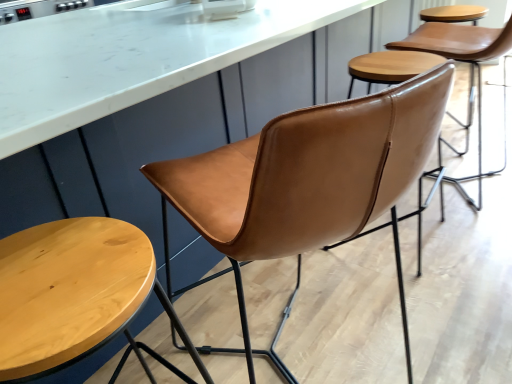
Question: Does cognac leather chair at center, acting as the 1th chair starting from the front, lie in front of wooden stool at lower left?

Choices:
 (A) no
 (B) yes

Answer: (B)

Question: From the image's perspective, would you say cognac leather chair at center, acting as the 1th chair starting from the front, is shown under wooden stool at lower left?

Choices:
 (A) yes
 (B) no

Answer: (B)

Question: Is cognac leather chair at center, acting as the 1th chair starting from the front, outside of wooden stool at lower left?

Choices:
 (A) no
 (B) yes

Answer: (B)

Question: From a real-world perspective, is cognac leather chair at center, arranged as the first chair when viewed from the left, located beneath wooden stool at lower left?

Choices:
 (A) no
 (B) yes

Answer: (A)

Question: Is cognac leather chair at center, which is counted as the second chair, starting from the right, looking in the opposite direction of wooden stool at lower left?

Choices:
 (A) yes
 (B) no

Answer: (B)

Question: Is cognac leather chair at center, arranged as the first chair when viewed from the left, to the left or to the right of wooden stool at lower left in the image?

Choices:
 (A) left
 (B) right

Answer: (B)

Question: In the image, is cognac leather chair at center, arranged as the first chair when viewed from the left, positioned in front of or behind wooden stool at lower left?

Choices:
 (A) behind
 (B) front

Answer: (B)

Question: Does point (297, 140) appear closer or farther from the camera than point (42, 349)?

Choices:
 (A) closer
 (B) farther

Answer: (B)

Question: From the image's perspective, relative to wooden stool at lower left, is cognac leather chair at center, which is the second chair in back-to-front order, above or below?

Choices:
 (A) above
 (B) below

Answer: (A)

Question: From the image's perspective, relative to wooden stool at lower left, is cognac leather chair at center, the 2th chair positioned from the front, above or below?

Choices:
 (A) above
 (B) below

Answer: (A)

Question: Considering the relative positions of cognac leather chair at center, the 2th chair positioned from the front, and wooden stool at lower left in the image provided, is cognac leather chair at center, the 2th chair positioned from the front, to the left or to the right of wooden stool at lower left?

Choices:
 (A) left
 (B) right

Answer: (B)

Question: Is cognac leather chair at center, acting as the 1th chair starting from the right, wider or thinner than wooden stool at lower left?

Choices:
 (A) thin
 (B) wide

Answer: (B)

Question: Relative to wooden stool at lower left, is cognac leather chair at center, which appears as the first chair when viewed from the back, in front or behind?

Choices:
 (A) front
 (B) behind

Answer: (B)

Question: In terms of height, does wooden stool at lower left look taller or shorter compared to cognac leather chair at center, arranged as the first chair when viewed from the left?

Choices:
 (A) short
 (B) tall

Answer: (A)

Question: Considering the relative positions of wooden stool at lower left and cognac leather chair at center, acting as the 1th chair starting from the front, in the image provided, is wooden stool at lower left to the left or to the right of cognac leather chair at center, acting as the 1th chair starting from the front,?

Choices:
 (A) right
 (B) left

Answer: (B)